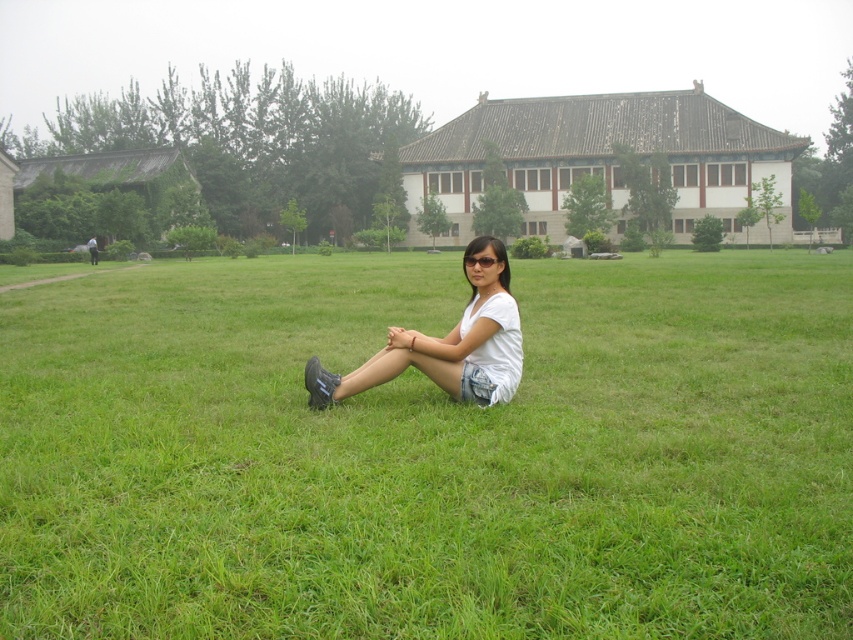
Is green grass at center to the right of white cotton shirt at center from the viewer's perspective?

Incorrect, green grass at center is not on the right side of white cotton shirt at center.

Can you confirm if green grass at center is bigger than white cotton shirt at center?

Correct, green grass at center is larger in size than white cotton shirt at center.

This screenshot has height=640, width=853. I want to click on green grass at center, so click(x=428, y=452).

Find the location of a particular element. The width and height of the screenshot is (853, 640). green grass at center is located at coordinates (428, 452).